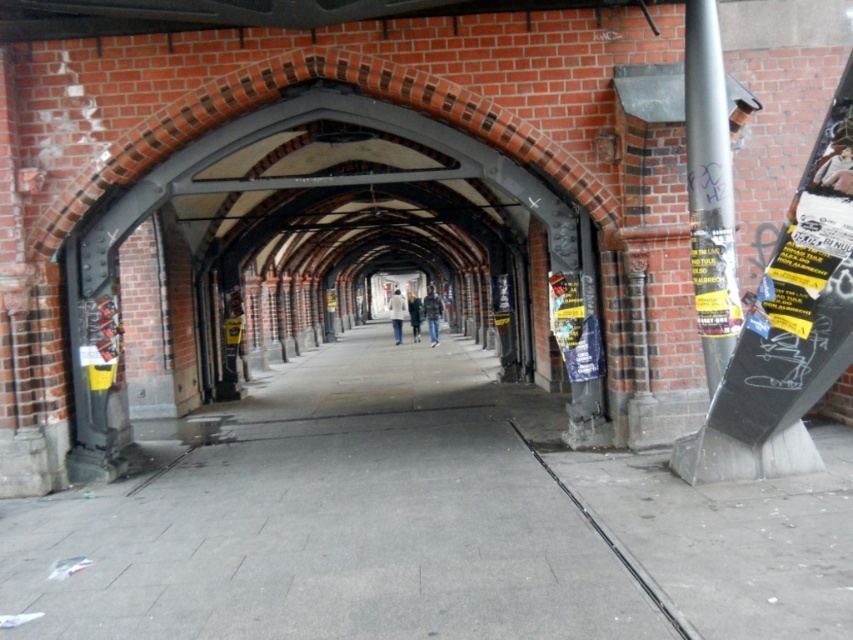
You are standing on the gray concrete pavement at center and want to move to the white fabric coat at center. Which direction should you move to reach it?

You should move to the right side to reach the white fabric coat at center because the gray concrete pavement at center is positioned on the left side of it.